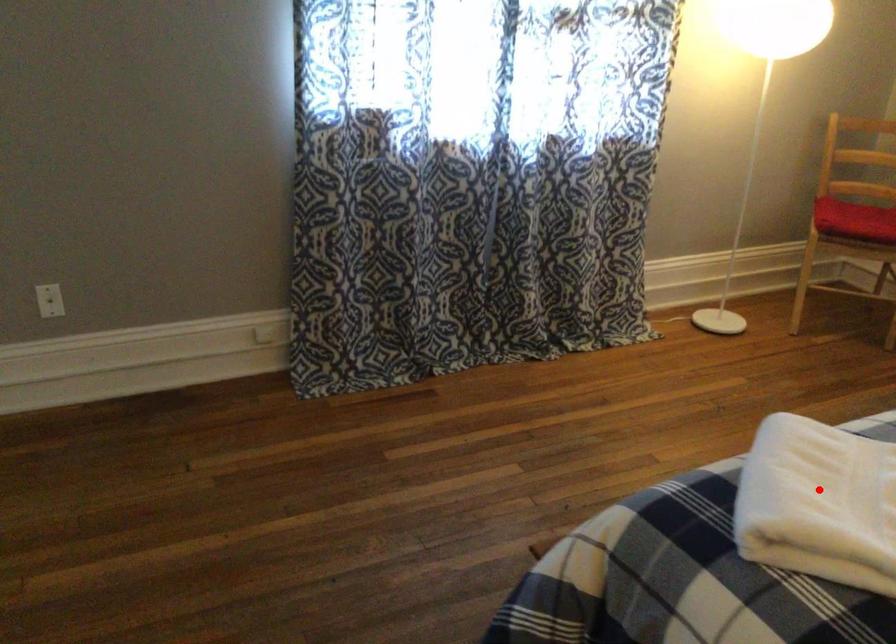
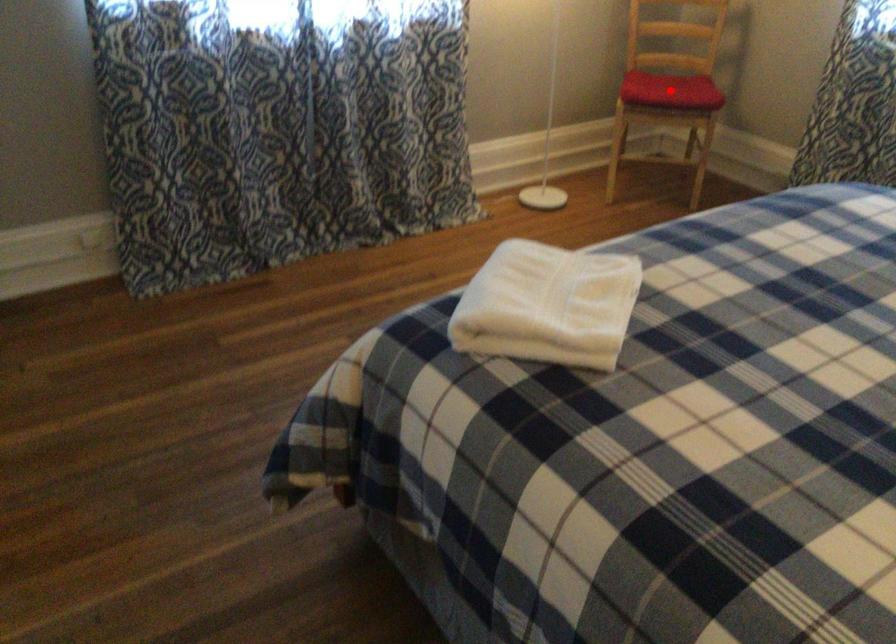
I am providing you with two images of the same scene from different viewpoints. A red point is marked on the first image and another point is marked on the second image. Is the marked point in image1 the same physical position as the marked point in image2?

No